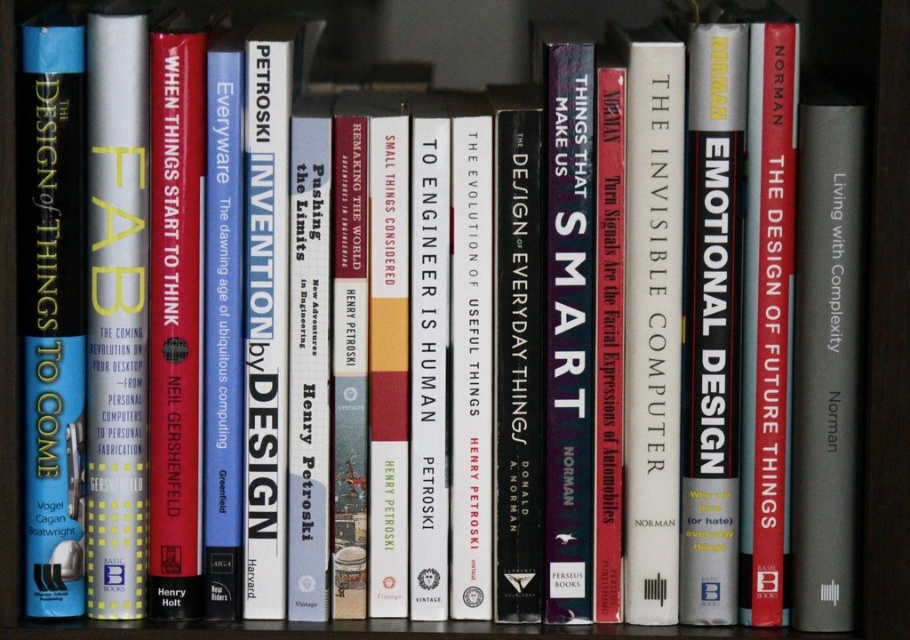
Question: Which of the following is the closest to the observer?

Choices:
 (A) gray matte book at center
 (B) blue hardcover book at left
 (C) red matte hardcover book at center

Answer: (A)

Question: Can you confirm if blue hardcover book at left is positioned below gray matte book at center?

Choices:
 (A) no
 (B) yes

Answer: (A)

Question: Which point appears farthest from the camera in this image?

Choices:
 (A) (844, 97)
 (B) (744, 492)
 (C) (35, 573)

Answer: (B)

Question: Is blue hardcover book at left bigger than red matte hardcover book at center?

Choices:
 (A) no
 (B) yes

Answer: (B)

Question: Estimate the real-world distances between objects in this image. Which object is closer to the red matte hardcover book at center?

Choices:
 (A) blue hardcover book at left
 (B) gray matte book at center

Answer: (B)

Question: Does blue hardcover book at left appear over gray matte book at center?

Choices:
 (A) no
 (B) yes

Answer: (B)